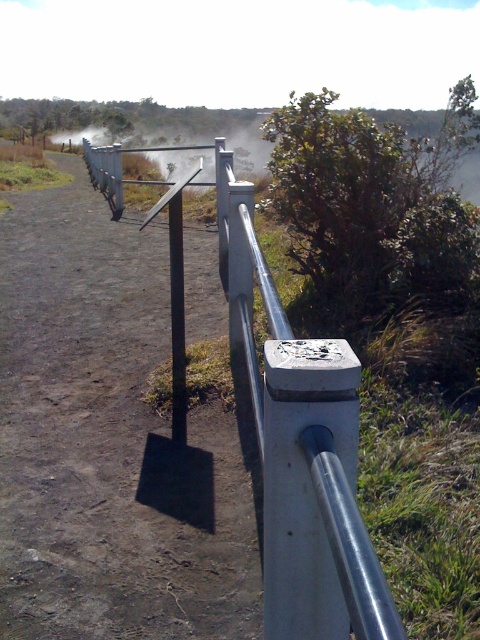
In the scene shown: Does metallic gray path at center have a greater width compared to silver metallic fence at center?

No, metallic gray path at center is not wider than silver metallic fence at center.

Which is in front, point (19, 236) or point (337, 410)?

Point (337, 410)

Is point (8, 515) less distant than point (180, 378)?

Yes, point (8, 515) is closer to viewer.

At what (x,y) coordinates should I click in order to perform the action: click on metallic gray path at center. Please return your answer as a coordinate pair (x, y). The height and width of the screenshot is (640, 480). Looking at the image, I should click on (108, 442).